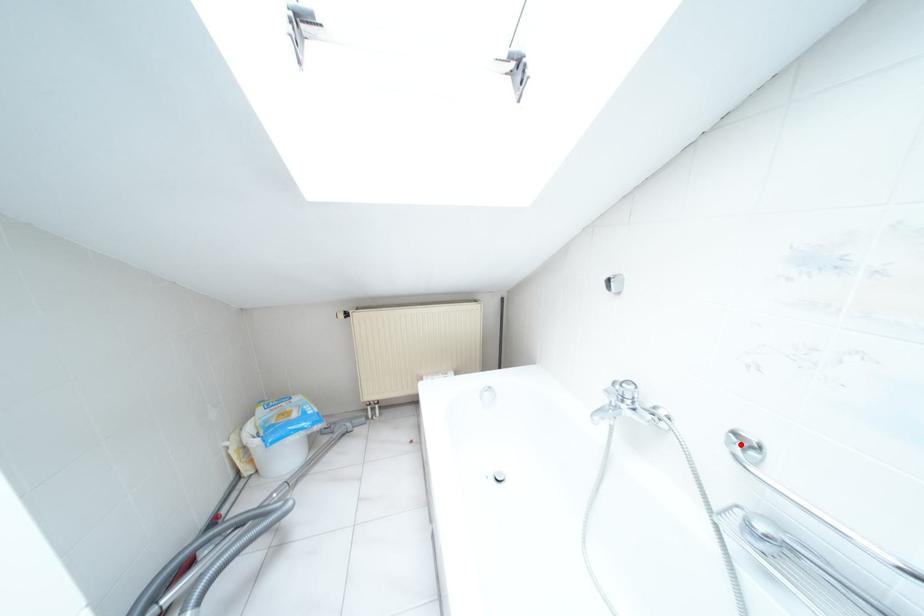
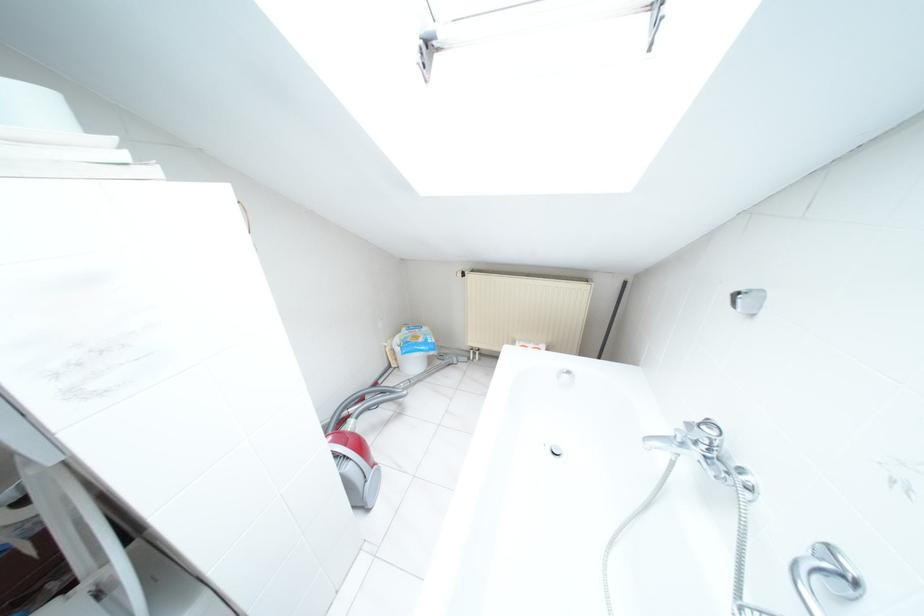
Where in the second image is the point corresponding to the highlighted location from the first image?

(825, 565)